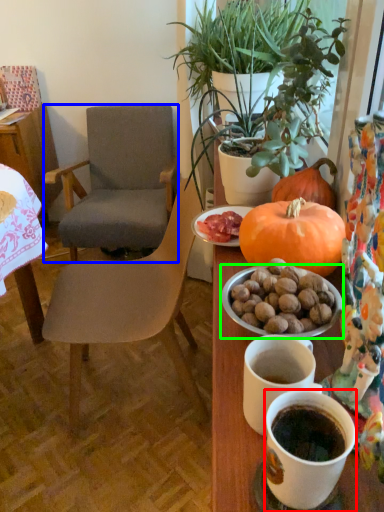
Question: Which is farther away from coffee cup (highlighted by a red box)? chair (highlighted by a blue box) or bowl (highlighted by a green box)?

Choices:
 (A) chair
 (B) bowl

Answer: (A)